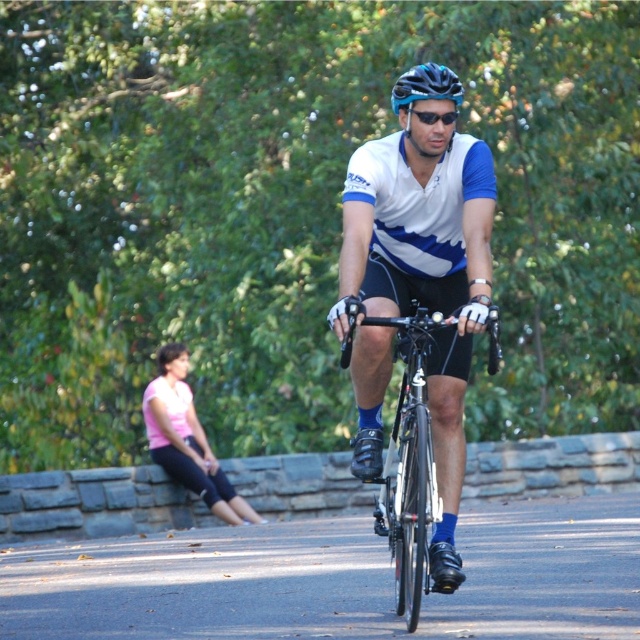
Is pink fabric shirt at lower left wider than black matte sunglasses at center?

Indeed, pink fabric shirt at lower left has a greater width compared to black matte sunglasses at center.

Does point (196, 433) come in front of point (417, 116)?

No, it is not.

Identify the location of pink fabric shirt at lower left. The width and height of the screenshot is (640, 640). (188, 440).

Where is `pink fabric shirt at lower left`? This screenshot has height=640, width=640. pink fabric shirt at lower left is located at coordinates (188, 440).

Consider the image. Measure the distance between point (x=364, y=186) and camera.

Point (x=364, y=186) is 7.81 meters away from camera.

From the picture: Does white/blue jersey at center appear over pink fabric shirt at lower left?

Yes.

Who is more forward, (424, 161) or (154, 426)?

Point (424, 161) is more forward.

Image resolution: width=640 pixels, height=640 pixels. What are the coordinates of `white/blue jersey at center` in the screenshot? It's located at (424, 276).

Who is positioned more to the left, pink fabric shirt at lower left or matte blue bicycle helmet at center?

pink fabric shirt at lower left

Does pink fabric shirt at lower left have a greater height compared to matte blue bicycle helmet at center?

No, pink fabric shirt at lower left is not taller than matte blue bicycle helmet at center.

Does point (189, 465) come in front of point (458, 83)?

No, it is not.

Where is `pink fabric shirt at lower left`? This screenshot has width=640, height=640. pink fabric shirt at lower left is located at coordinates (188, 440).